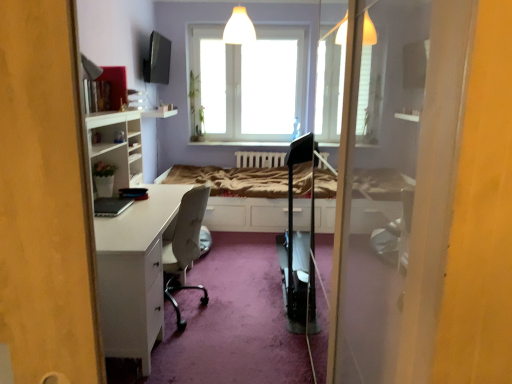
I want to click on free location to the right of white glossy desk at left, so click(x=229, y=308).